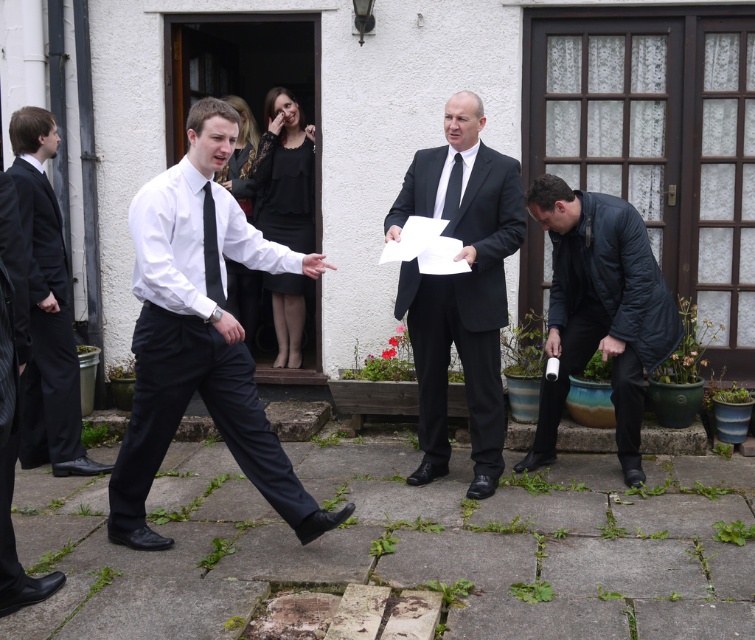
Is matte black suit at center positioned at the back of dark blue quilted jacket at lower right?

No, matte black suit at center is closer to the viewer.

Does point (470, 188) come closer to viewer compared to point (606, 241)?

Yes, it is.

Which is in front, point (484, 285) or point (621, 275)?

Positioned in front is point (484, 285).

At what (x,y) coordinates should I click in order to perform the action: click on matte black suit at center. Please return your answer as a coordinate pair (x, y). Looking at the image, I should click on (461, 291).

Who is more distant from viewer, [407,292] or [458,189]?

Positioned behind is point [407,292].

Does matte black suit at center appear on the right side of black silk tie at center?

Yes, matte black suit at center is to the right of black silk tie at center.

Which is in front, point (408, 291) or point (458, 179)?

Positioned in front is point (458, 179).

You are a GUI agent. You are given a task and a screenshot of the screen. Output one action in this format:
    pyautogui.click(x=<x>, y=<y>)
    Task: Click on the matte black suit at center
    
    Given the screenshot: What is the action you would take?
    pyautogui.click(x=461, y=291)

Is matte black suit at left to the left of matte black dress at center from the viewer's perspective?

Yes, matte black suit at left is to the left of matte black dress at center.

Locate an element on the screen. This screenshot has width=755, height=640. matte black suit at left is located at coordinates (45, 307).